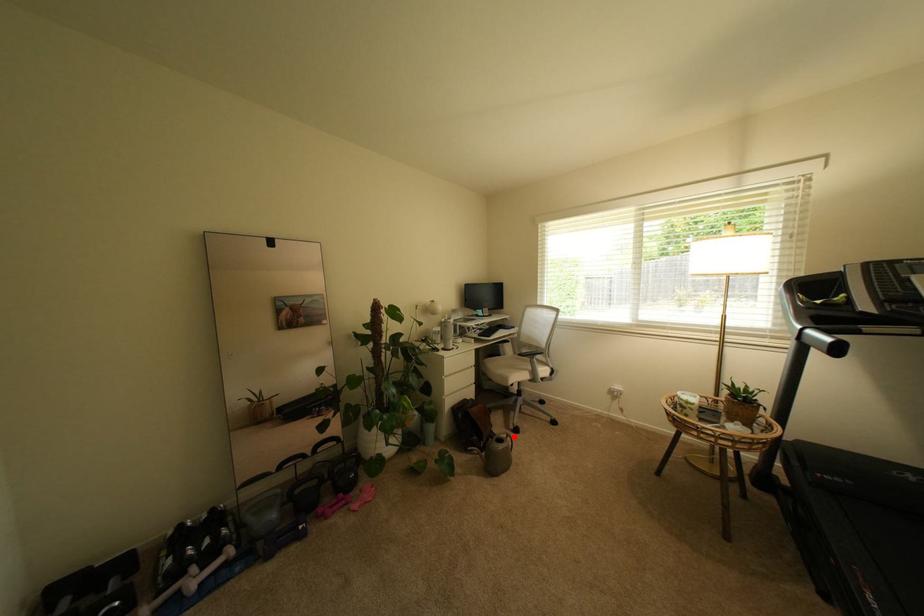
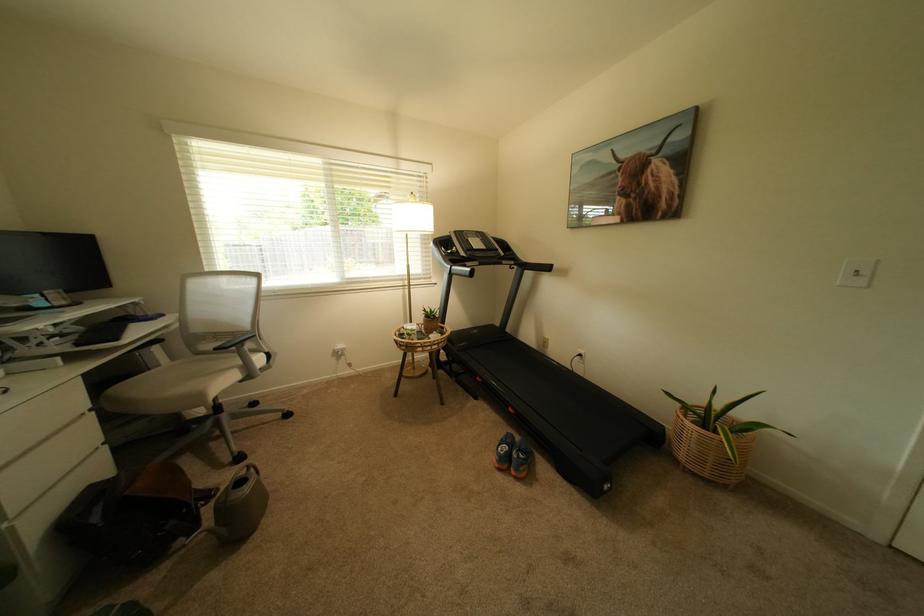
The point at the highlighted location is marked in the first image. Where is the corresponding point in the second image?

(253, 471)